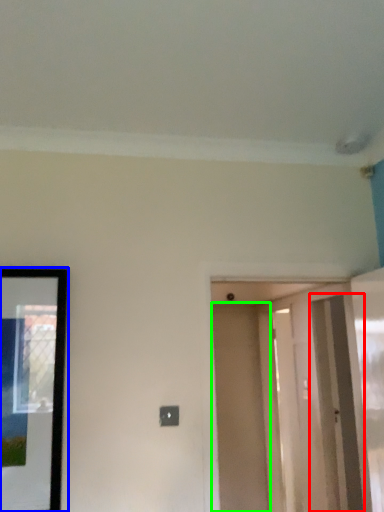
Question: Which object is the farthest from screen door (highlighted by a red box)? Choose among these: picture frame (highlighted by a blue box) or door (highlighted by a green box).

Choices:
 (A) picture frame
 (B) door

Answer: (A)